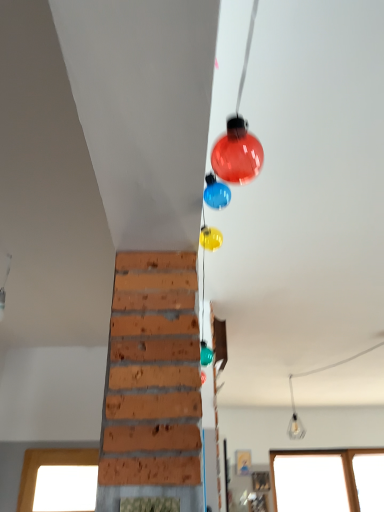
Image resolution: width=384 pixels, height=512 pixels. In order to click on clear glass light bulb at center in this screenshot , I will do `click(294, 419)`.

What do you see at coordinates (294, 419) in the screenshot? Image resolution: width=384 pixels, height=512 pixels. I see `clear glass light bulb at center` at bounding box center [294, 419].

Describe the element at coordinates (328, 480) in the screenshot. I see `transparent glass window at lower right` at that location.

Where is `transparent glass window at lower right`? The width and height of the screenshot is (384, 512). transparent glass window at lower right is located at coordinates (328, 480).

What are the coordinates of `clear glass light bulb at center` in the screenshot? It's located at (294, 419).

Is clear glass light bulb at center to the left or to the right of transparent glass window at lower right in the image?

In the image, clear glass light bulb at center appears on the left side of transparent glass window at lower right.

Which is in front, clear glass light bulb at center or transparent glass window at lower right?

Positioned in front is clear glass light bulb at center.

Is point (288, 429) closer or farther from the camera than point (314, 489)?

Point (288, 429) is farther from the camera than point (314, 489).

From the image's perspective, is clear glass light bulb at center positioned above or below transparent glass window at lower right?

clear glass light bulb at center is above transparent glass window at lower right.

From a real-world perspective, is clear glass light bulb at center physically above transparent glass window at lower right?

Yes.

Considering the sizes of clear glass light bulb at center and transparent glass window at lower right in the image, is clear glass light bulb at center wider or thinner than transparent glass window at lower right?

In the image, clear glass light bulb at center appears to be wider than transparent glass window at lower right.

Which of these two, clear glass light bulb at center or transparent glass window at lower right, stands taller?

Standing taller between the two is transparent glass window at lower right.

Which of these two, clear glass light bulb at center or transparent glass window at lower right, is smaller?

clear glass light bulb at center.

Is clear glass light bulb at center situated inside transparent glass window at lower right or outside?

clear glass light bulb at center lies outside transparent glass window at lower right.

Is clear glass light bulb at center positioned far away from transparent glass window at lower right?

clear glass light bulb at center is near transparent glass window at lower right, not far away.

Is clear glass light bulb at center positioned with its back to transparent glass window at lower right?

That's not correct — clear glass light bulb at center is not looking away from transparent glass window at lower right.

The height and width of the screenshot is (512, 384). In order to click on window that is under the clear glass light bulb at center (from a real-world perspective) in this screenshot , I will do `click(328, 480)`.

In the scene shown: Is transparent glass window at lower right to the right of clear glass light bulb at center from the viewer's perspective?

Correct, you'll find transparent glass window at lower right to the right of clear glass light bulb at center.

Between transparent glass window at lower right and clear glass light bulb at center, which one is positioned behind?

Positioned behind is transparent glass window at lower right.

Considering the positions of point (354, 488) and point (292, 436), is point (354, 488) closer or farther from the camera than point (292, 436)?

Point (354, 488) appears to be closer to the viewer than point (292, 436).

From the image's perspective, is transparent glass window at lower right over clear glass light bulb at center?

No.

From a real-world perspective, which object rests below the other?

In real-world perspective, transparent glass window at lower right is lower.

Which object is wider, transparent glass window at lower right or clear glass light bulb at center?

Wider between the two is clear glass light bulb at center.

From the picture: Does transparent glass window at lower right have a greater height compared to clear glass light bulb at center?

Yes, transparent glass window at lower right is taller than clear glass light bulb at center.

Considering the sizes of objects transparent glass window at lower right and clear glass light bulb at center in the image provided, who is smaller, transparent glass window at lower right or clear glass light bulb at center?

clear glass light bulb at center is smaller.

Is transparent glass window at lower right situated inside clear glass light bulb at center or outside?

transparent glass window at lower right lies outside clear glass light bulb at center.

Is transparent glass window at lower right touching clear glass light bulb at center?

There is a gap between transparent glass window at lower right and clear glass light bulb at center.

Looking at this image, is clear glass light bulb at center at the back of transparent glass window at lower right?

No.

How many degrees apart are the facing directions of transparent glass window at lower right and clear glass light bulb at center?

0.642 degrees.

Identify the location of light fixture located above the transparent glass window at lower right (from a real-world perspective). (294, 419).

The height and width of the screenshot is (512, 384). In order to click on window below the clear glass light bulb at center (from the image's perspective) in this screenshot , I will do `click(328, 480)`.

Identify the location of light fixture above the transparent glass window at lower right (from the image's perspective). The image size is (384, 512). (294, 419).